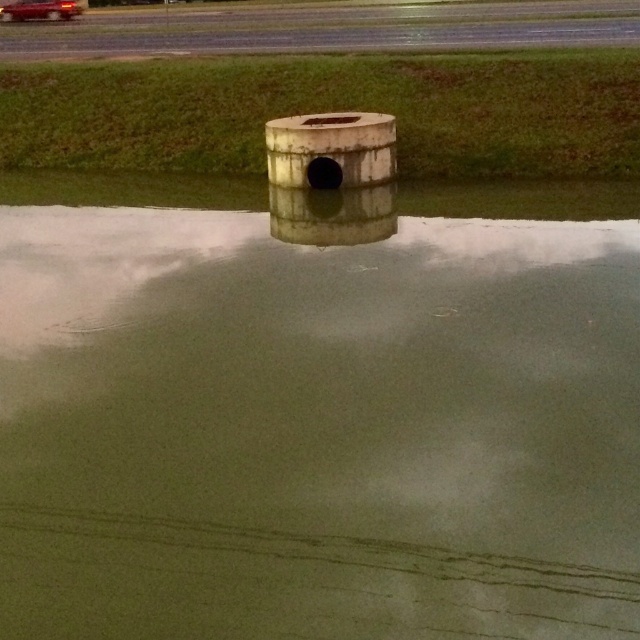
Does point (276, 432) come farther from viewer compared to point (568, 1)?

No, (276, 432) is closer to viewer.

Between green matte water at center and concrete runway at upper center, which one has more height?

With more height is concrete runway at upper center.

Between point (316, 500) and point (246, 8), which one is positioned behind?

The point (246, 8) is more distant.

Find the location of a particular element. green matte water at center is located at coordinates (316, 428).

Is concrete runway at upper center smaller than metallic red car at upper left?

Incorrect, concrete runway at upper center is not smaller in size than metallic red car at upper left.

Is point (572, 44) farther from camera compared to point (68, 13)?

That is False.

What are the coordinates of `concrete runway at upper center` in the screenshot? It's located at (326, 28).

Who is taller, green matte water at center or matte concrete pipe at center?

green matte water at center

Is green matte water at center above matte concrete pipe at center?

No.

Who is more distant from viewer, [536,484] or [317,204]?

The point [317,204] is behind.

Identify the location of green matte water at center. This screenshot has width=640, height=640. (316, 428).